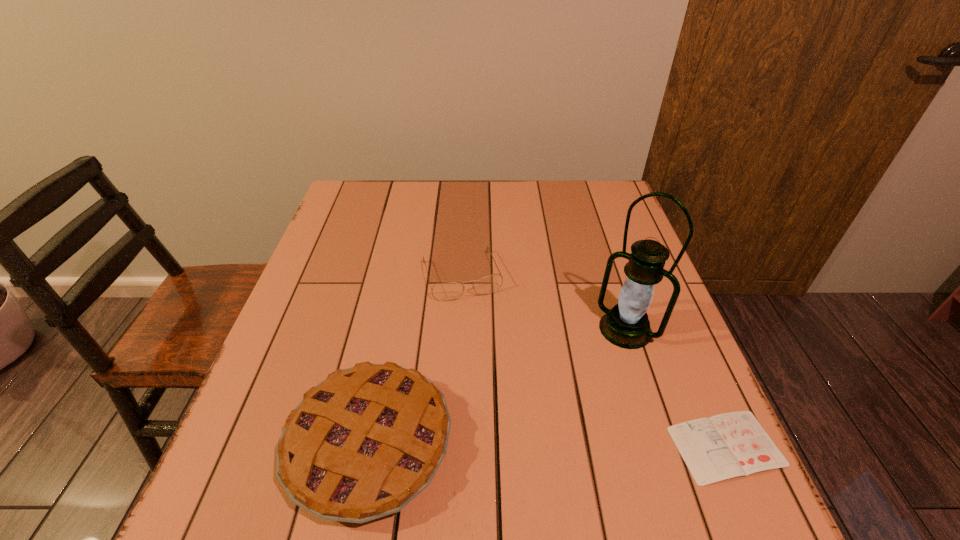
You are a GUI agent. You are given a task and a screenshot of the screen. Output one action in this format:
    pyautogui.click(x=<x>, y=<y>)
    Task: Click on the object that is at the near right corner
    Image resolution: width=960 pixels, height=540 pixels.
    Given the screenshot: What is the action you would take?
    pyautogui.click(x=729, y=445)

Locate an element on the screen. free location at the far edge is located at coordinates (554, 189).

Where is `vacant space at the left edge of the desktop`? vacant space at the left edge of the desktop is located at coordinates click(310, 266).

Identify the location of vacant space at the right edge of the desktop. The image size is (960, 540). (617, 278).

The height and width of the screenshot is (540, 960). I want to click on free space at the far left corner, so click(x=362, y=201).

This screenshot has height=540, width=960. I want to click on unoccupied position between the shortest object and the third shortest object, so click(548, 445).

Locate an element on the screen. The image size is (960, 540). free space between the diary and the pie is located at coordinates pos(548,445).

What are the coordinates of `free space that is in between the shortest object and the third shortest object` in the screenshot? It's located at (548, 445).

This screenshot has height=540, width=960. What are the coordinates of `free area in between the shortest object and the pie` in the screenshot? It's located at (548, 445).

Locate an element on the screen. empty location between the third shortest object and the spectacles is located at coordinates (416, 360).